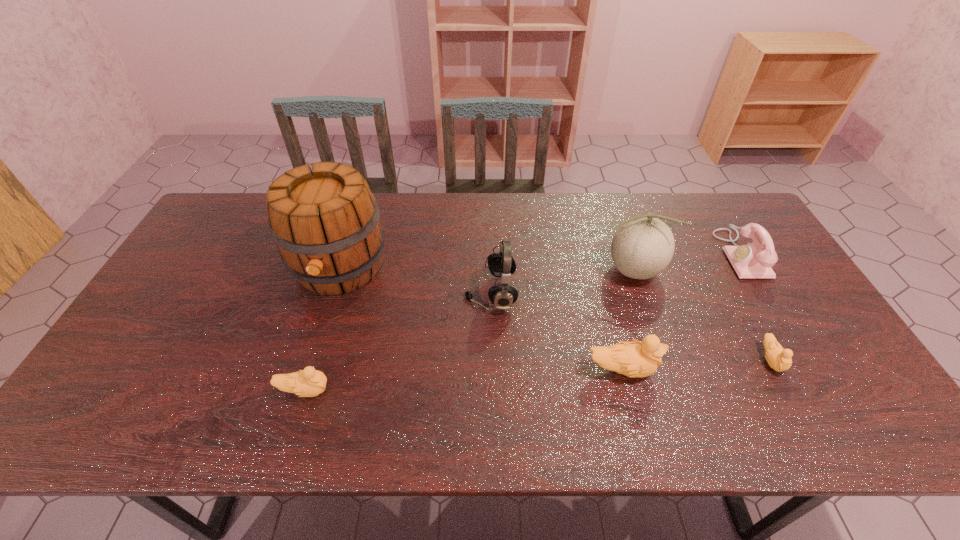
The width and height of the screenshot is (960, 540). Identify the location of cider that is at the far edge. (325, 221).

Identify the location of telephone at the far edge. (754, 260).

In order to click on duckling situated at the right edge in this screenshot , I will do `click(778, 358)`.

Locate an element on the screen. The width and height of the screenshot is (960, 540). telephone at the right edge is located at coordinates (754, 260).

Locate an element on the screen. This screenshot has height=540, width=960. object that is at the far right corner is located at coordinates (754, 260).

Where is `object that is at the near right corner`? The width and height of the screenshot is (960, 540). object that is at the near right corner is located at coordinates (778, 358).

Locate an element on the screen. This screenshot has height=540, width=960. vacant space at the far edge is located at coordinates (494, 223).

Locate an element on the screen. free spot at the near edge of the desktop is located at coordinates (533, 367).

Where is `blank space at the left edge`? The width and height of the screenshot is (960, 540). blank space at the left edge is located at coordinates (165, 356).

Locate an element on the screen. vacant area at the right edge is located at coordinates (779, 261).